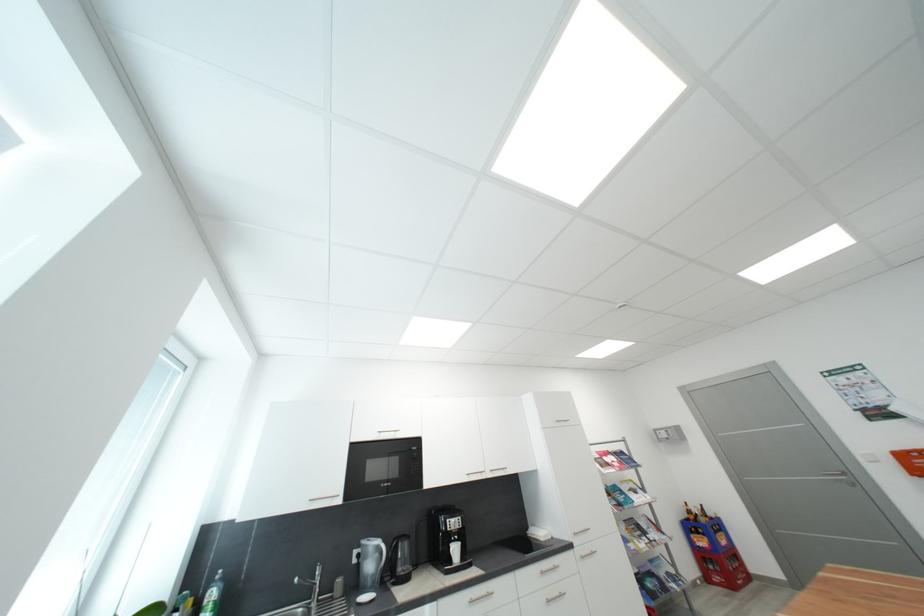
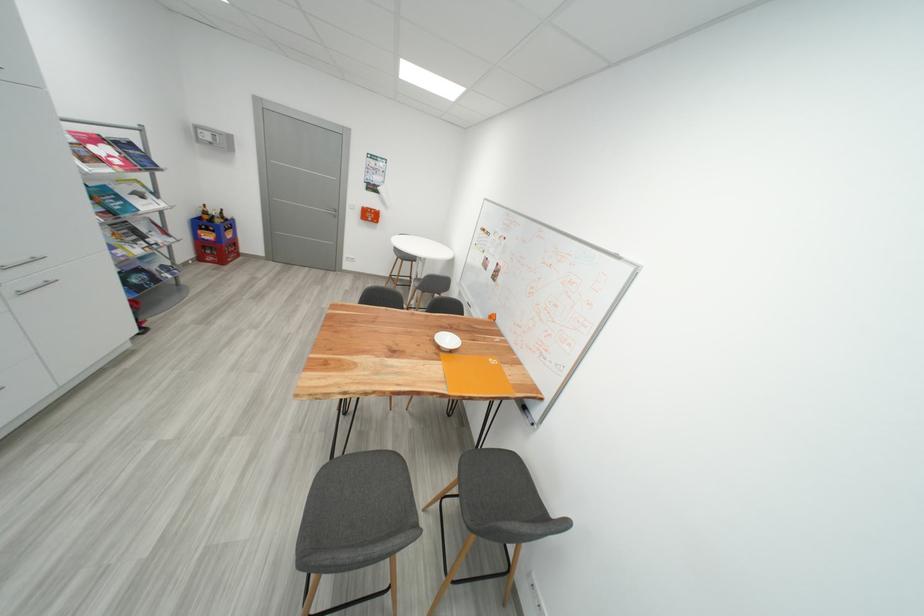
Find the pixel in the second image that matches (x=614, y=466) in the first image.

(104, 161)